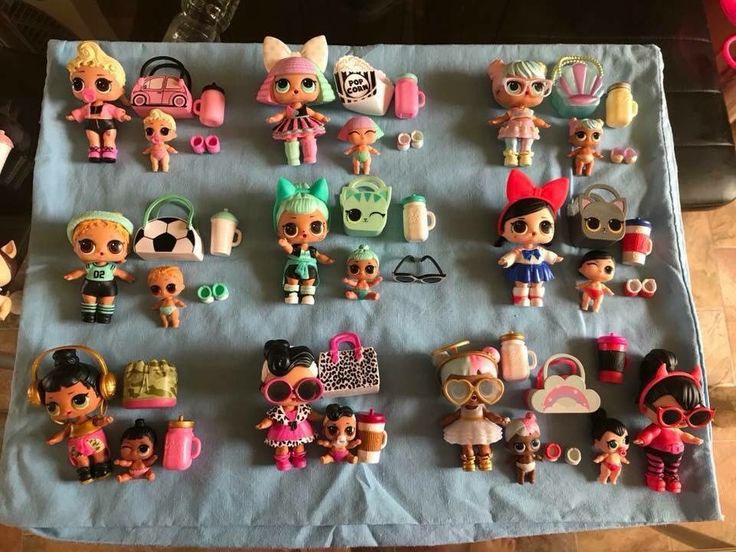
Identify the location of doll purses. coord(152,378), coord(159,231), coord(173,95), coord(355,83), coord(375,196), coord(346,355), coord(562,391), coord(601,214), coord(581,95).